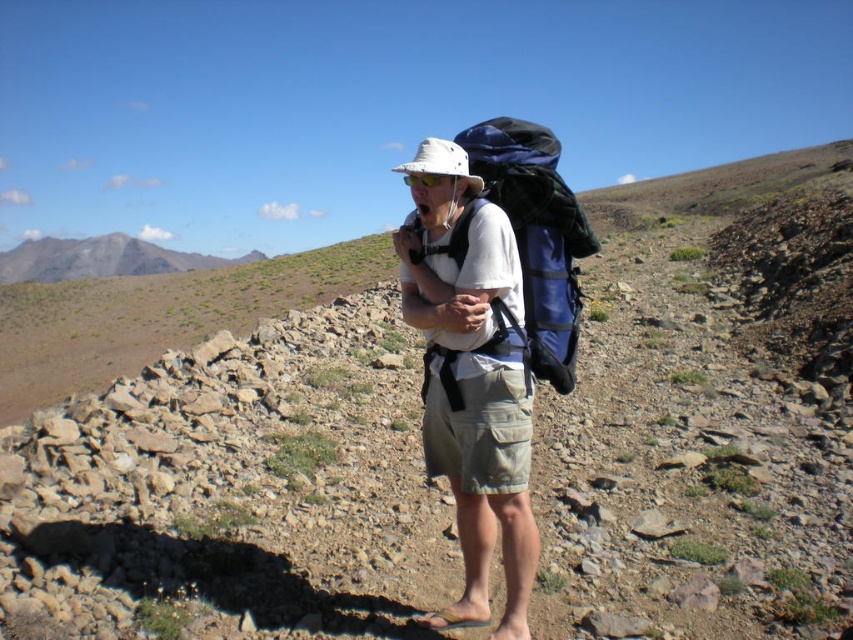
Who is positioned more to the right, matte white hat at center or blue fabric backpack at center?

From the viewer's perspective, blue fabric backpack at center appears more on the right side.

Can you confirm if matte white hat at center is bigger than blue fabric backpack at center?

Actually, matte white hat at center might be smaller than blue fabric backpack at center.

Image resolution: width=853 pixels, height=640 pixels. I want to click on matte white hat at center, so click(x=471, y=380).

Find the location of `matte white hat at center`. matte white hat at center is located at coordinates (471, 380).

Is point (503, 232) positioned behind point (106, 236)?

No, it is not.

Between point (436, 266) and point (59, 248), which one is positioned behind?

The point (59, 248) is behind.

Find the location of `matte white hat at center`. matte white hat at center is located at coordinates (471, 380).

Who is taller, blue fabric backpack at center or gray rocky mountain at upper left?

gray rocky mountain at upper left

Is blue fabric backpack at center behind gray rocky mountain at upper left?

That is False.

Image resolution: width=853 pixels, height=640 pixels. Describe the element at coordinates (537, 236) in the screenshot. I see `blue fabric backpack at center` at that location.

The image size is (853, 640). Find the location of `blue fabric backpack at center`. blue fabric backpack at center is located at coordinates (537, 236).